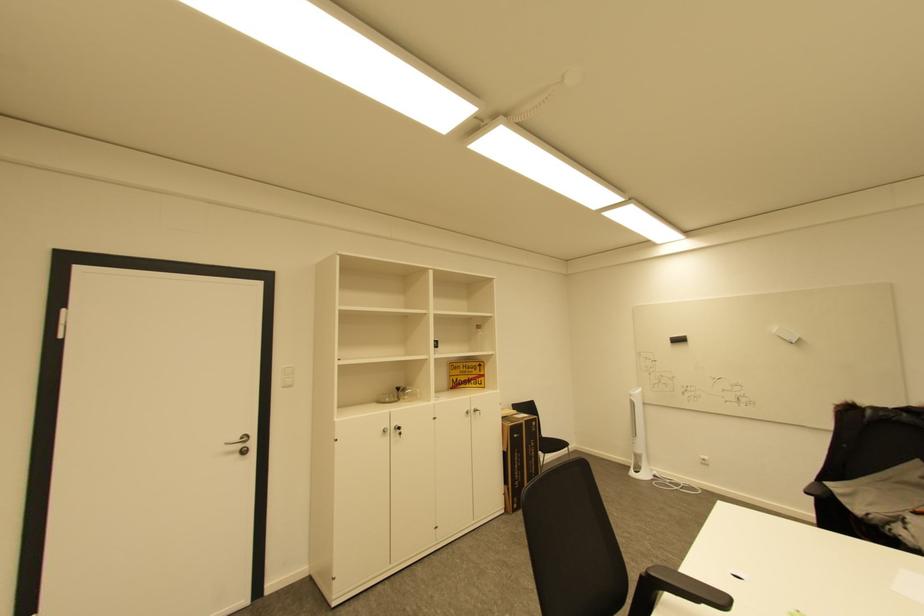
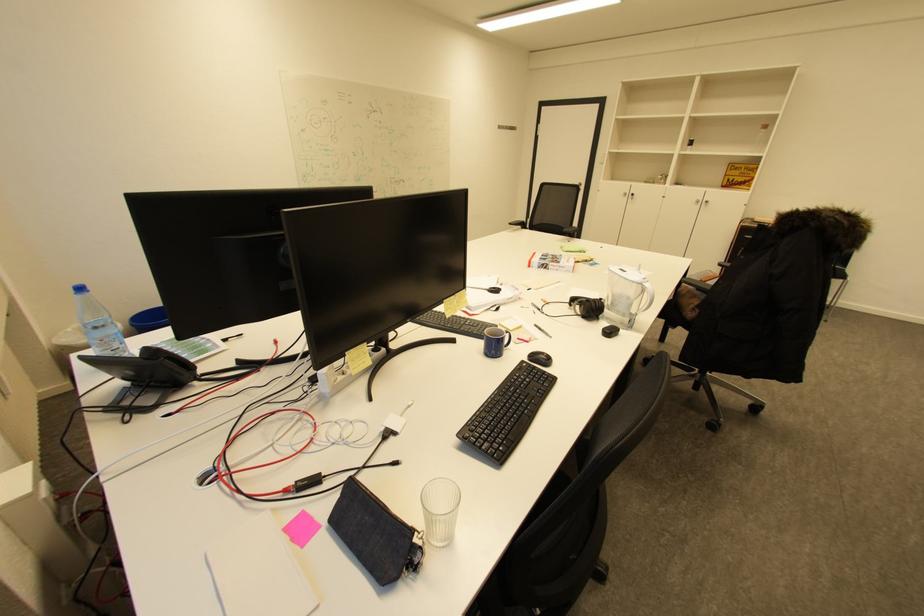
The point at (391, 432) is marked in the first image. Where is the corresponding point in the second image?

(630, 195)